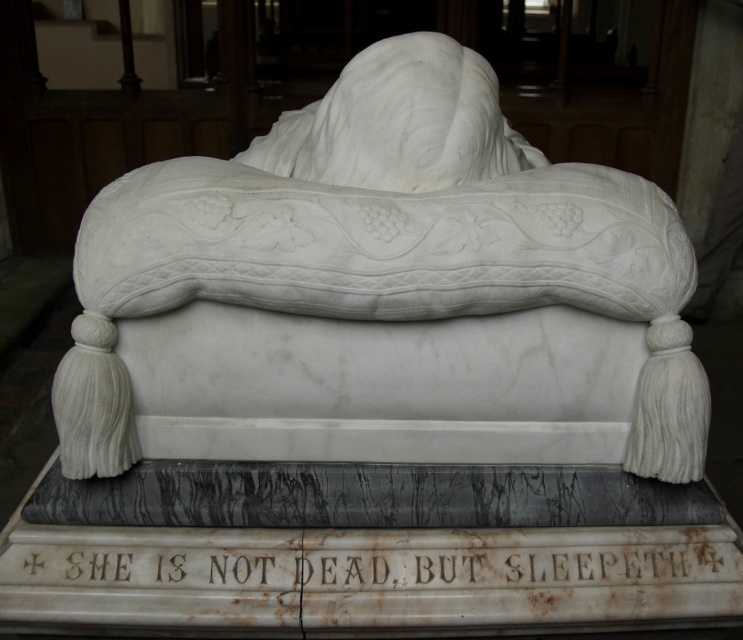
Question: From the image, what is the correct spatial relationship of white marble bed at center in relation to white marble text at center?

Choices:
 (A) below
 (B) above

Answer: (B)

Question: Which point is closer to the camera?

Choices:
 (A) white marble bed at center
 (B) white marble text at center

Answer: (A)

Question: From the image, what is the correct spatial relationship of white marble bed at center in relation to white marble text at center?

Choices:
 (A) above
 (B) below

Answer: (A)

Question: Which object appears farthest from the camera in this image?

Choices:
 (A) white marble bed at center
 (B) white marble text at center

Answer: (B)

Question: Where is white marble bed at center located in relation to white marble text at center in the image?

Choices:
 (A) below
 (B) above

Answer: (B)